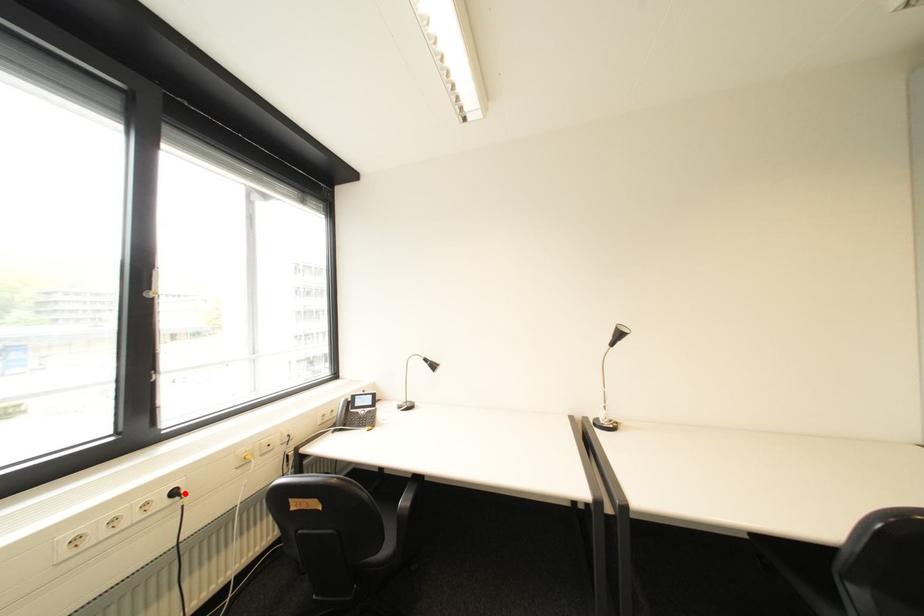
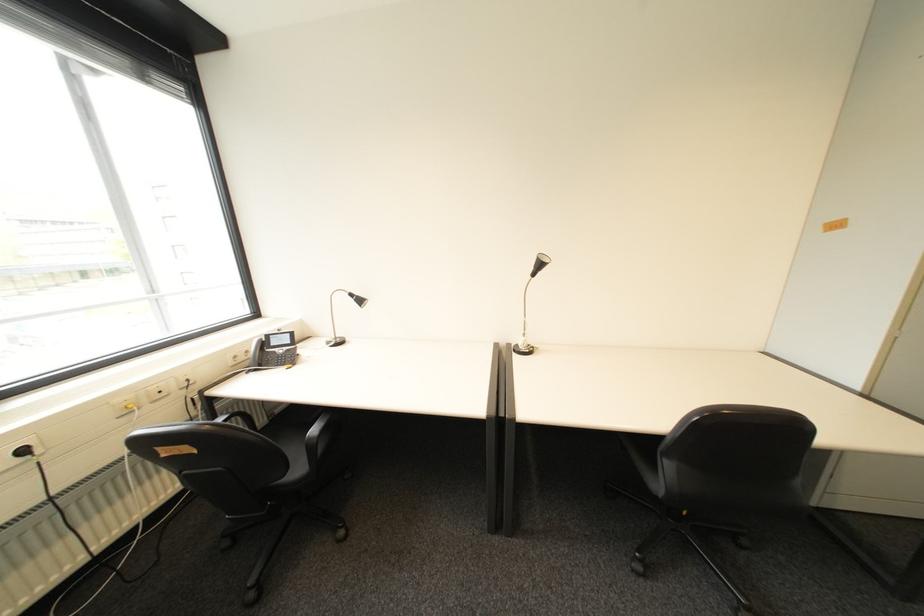
In the second image, find the point that corresponds to the highlighted location in the first image.

(34, 452)